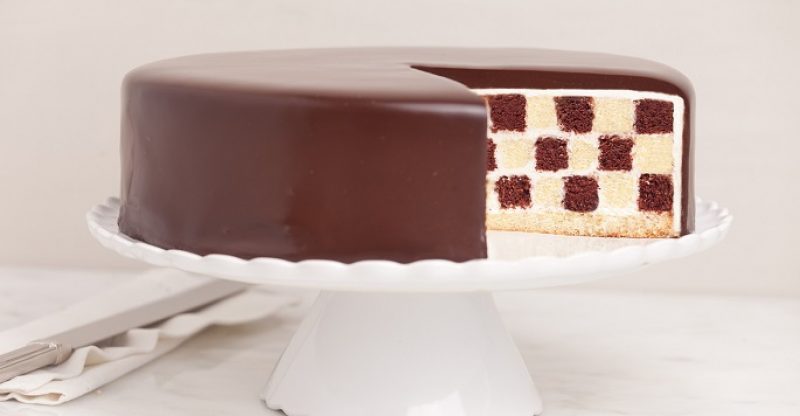
This screenshot has width=800, height=416. Identify the location of cloth napkin. (110, 370).